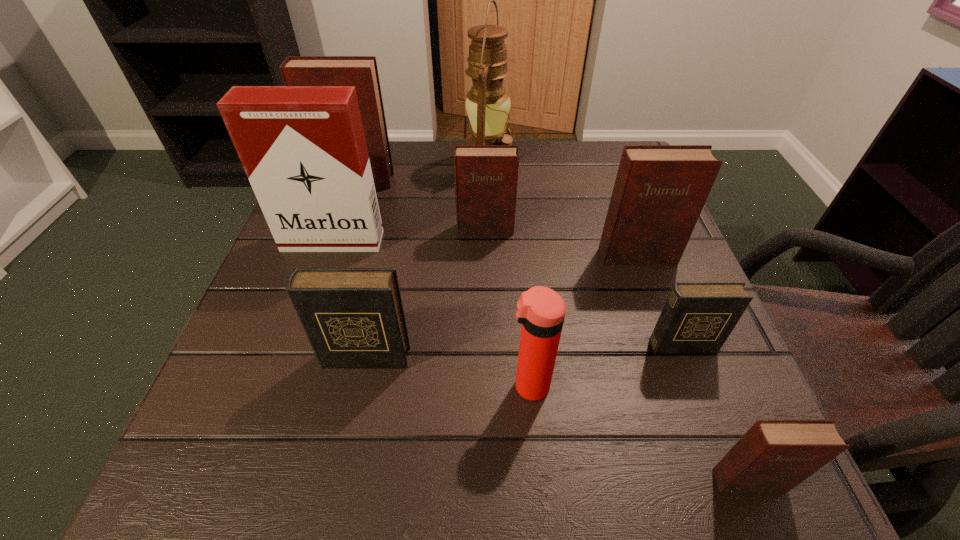
The width and height of the screenshot is (960, 540). Identify the location of vacant space at the right edge. (654, 286).

Identify the location of free region at the far right corner of the desktop. The height and width of the screenshot is (540, 960). (586, 148).

Where is `empty space between the third nearest reddish-brown diary and the farthest reddish-brown diary`? empty space between the third nearest reddish-brown diary and the farthest reddish-brown diary is located at coordinates (420, 205).

At what (x,y) coordinates should I click in order to perform the action: click on unoccupied position between the oil lamp and the red cigarette_case. Please return your answer as a coordinate pair (x, y). This screenshot has height=540, width=960. Looking at the image, I should click on (410, 200).

What are the coordinates of `empty location between the red cigarette_case and the second nearest object` in the screenshot? It's located at (431, 314).

The image size is (960, 540). I want to click on vacant area between the second biggest reddish-brown diary and the red cigarette_case, so click(485, 249).

What are the coordinates of `vacant space that's between the nearest reddish-brown diary and the left dark diary` in the screenshot? It's located at (557, 419).

Find the location of `free space between the thermos bottle and the left dark diary`. free space between the thermos bottle and the left dark diary is located at coordinates (447, 372).

You are a GUI agent. You are given a task and a screenshot of the screen. Output one action in this format:
    pyautogui.click(x=<x>, y=<y>)
    Task: Click on the vacant region between the eighth farthest object and the right dark diary
    Image resolution: width=960 pixels, height=540 pixels.
    Given the screenshot: What is the action you would take?
    pyautogui.click(x=606, y=366)

Identify the location of free point between the bigger dark diary and the fifth shortest diary. The image size is (960, 540). (501, 307).